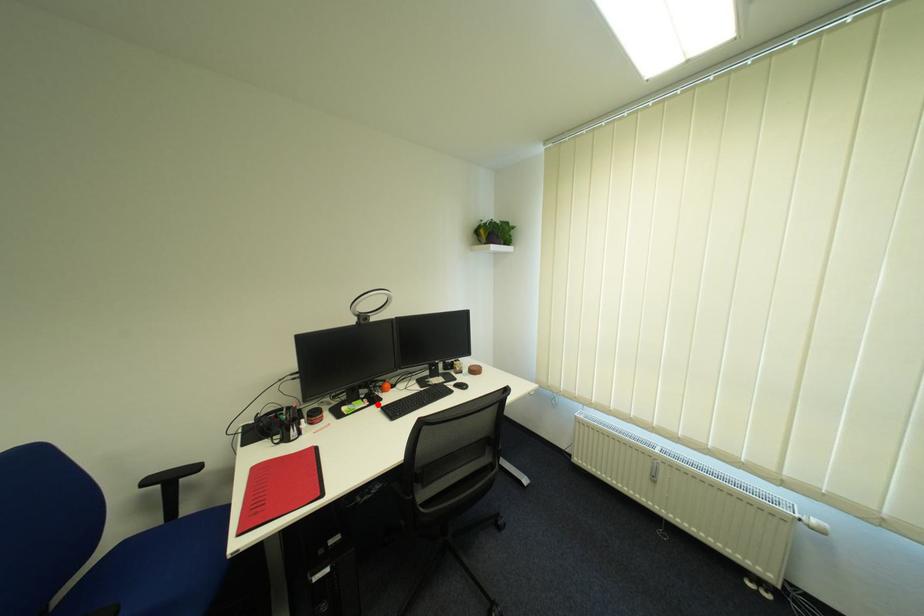
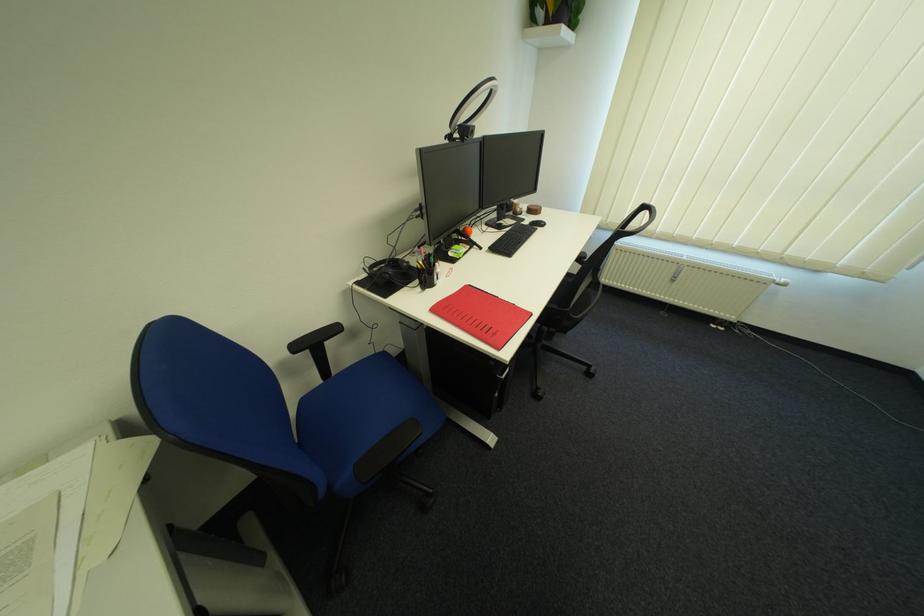
In the second image, find the point that corresponds to the highlighted location in the first image.

(479, 248)